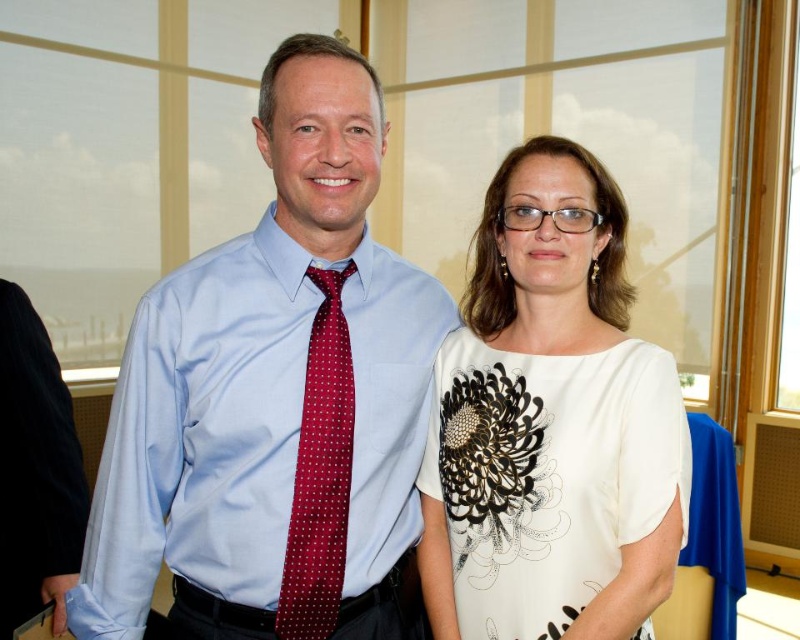
From the picture: Measure the distance between light blue shirt at center and white printed blouse at center.

A distance of 29.43 centimeters exists between light blue shirt at center and white printed blouse at center.

Who is positioned more to the left, light blue shirt at center or white printed blouse at center?

light blue shirt at center is more to the left.

Is point (288, 310) behind point (612, 300)?

No, it is in front of (612, 300).

Where is `light blue shirt at center`? This screenshot has height=640, width=800. light blue shirt at center is located at coordinates (274, 397).

Does light blue shirt at center have a greater width compared to maroon silk tie at center?

Yes.

Consider the image. Who is lower down, light blue shirt at center or maroon silk tie at center?

Positioned lower is maroon silk tie at center.

Image resolution: width=800 pixels, height=640 pixels. What do you see at coordinates (274, 397) in the screenshot?
I see `light blue shirt at center` at bounding box center [274, 397].

Identify the location of light blue shirt at center. This screenshot has width=800, height=640. (274, 397).

Is white printed blouse at center thinner than maroon silk tie at center?

No.

From the picture: Can you confirm if white printed blouse at center is positioned below maroon silk tie at center?

Incorrect, white printed blouse at center is not positioned below maroon silk tie at center.

Find the location of a particular element. This screenshot has height=640, width=800. white printed blouse at center is located at coordinates (550, 422).

You are a GUI agent. You are given a task and a screenshot of the screen. Output one action in this format:
    pyautogui.click(x=<x>, y=<y>)
    Task: Click on the white printed blouse at center
    The height and width of the screenshot is (640, 800).
    Given the screenshot: What is the action you would take?
    pyautogui.click(x=550, y=422)